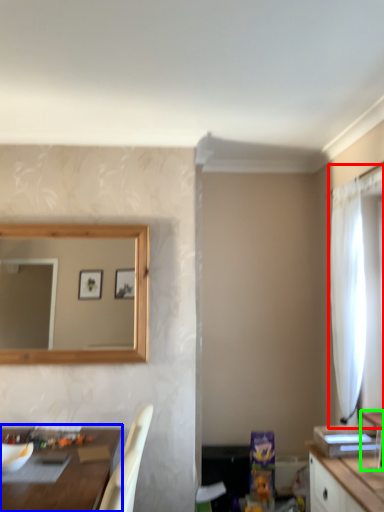
Question: Based on their relative distances, which object is farther from curtain (highlighted by a red box)? Choose from table (highlighted by a blue box) and vanity (highlighted by a green box).

Choices:
 (A) table
 (B) vanity

Answer: (A)